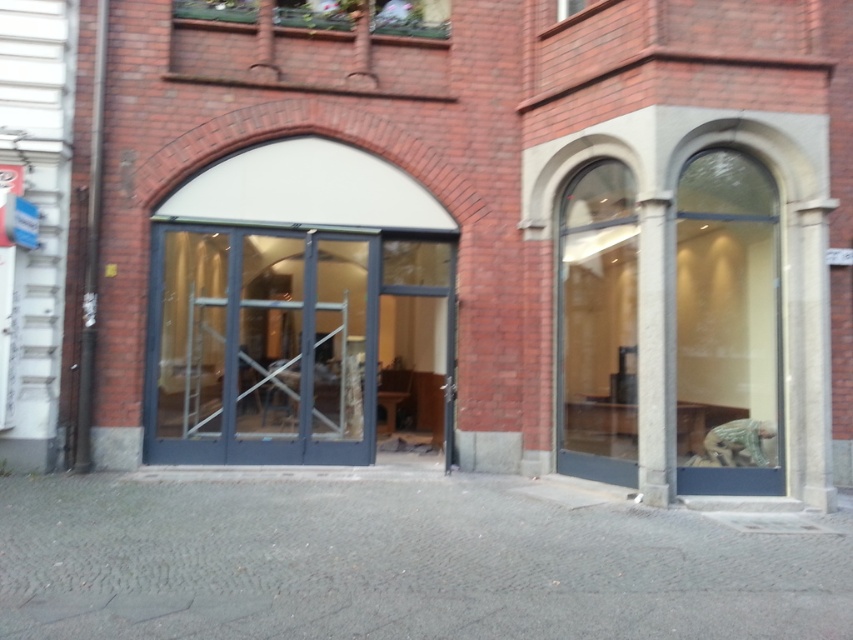
Question: Which point is closer to the camera?

Choices:
 (A) (207, 385)
 (B) (665, 348)

Answer: (B)

Question: Does transparent glass door at center have a greater width compared to gray stone column at right?

Choices:
 (A) no
 (B) yes

Answer: (B)

Question: Which point is farther to the camera?

Choices:
 (A) (659, 362)
 (B) (192, 403)

Answer: (B)

Question: Which point appears closest to the camera in this image?

Choices:
 (A) (668, 378)
 (B) (376, 280)

Answer: (A)

Question: Does transparent glass door at center have a lesser width compared to gray stone column at right?

Choices:
 (A) yes
 (B) no

Answer: (B)

Question: Is transparent glass door at center to the right of gray stone column at right from the viewer's perspective?

Choices:
 (A) no
 (B) yes

Answer: (A)